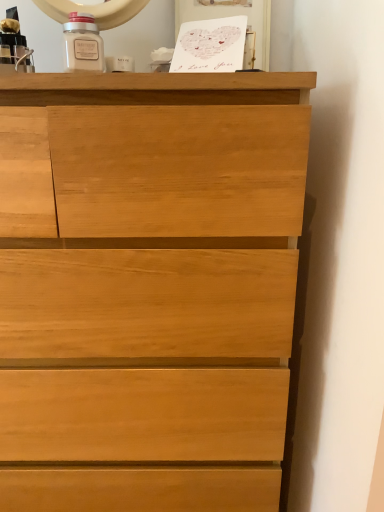
I want to click on light wood chest of drawers at center, so click(148, 287).

In order to face light wood chest of drawers at center, should I rotate leftwards or rightwards?

A 11.769 degree turn to the left will do.

Describe the element at coordinates (148, 287) in the screenshot. I see `light wood chest of drawers at center` at that location.

The image size is (384, 512). Find the location of `light wood chest of drawers at center`. light wood chest of drawers at center is located at coordinates (148, 287).